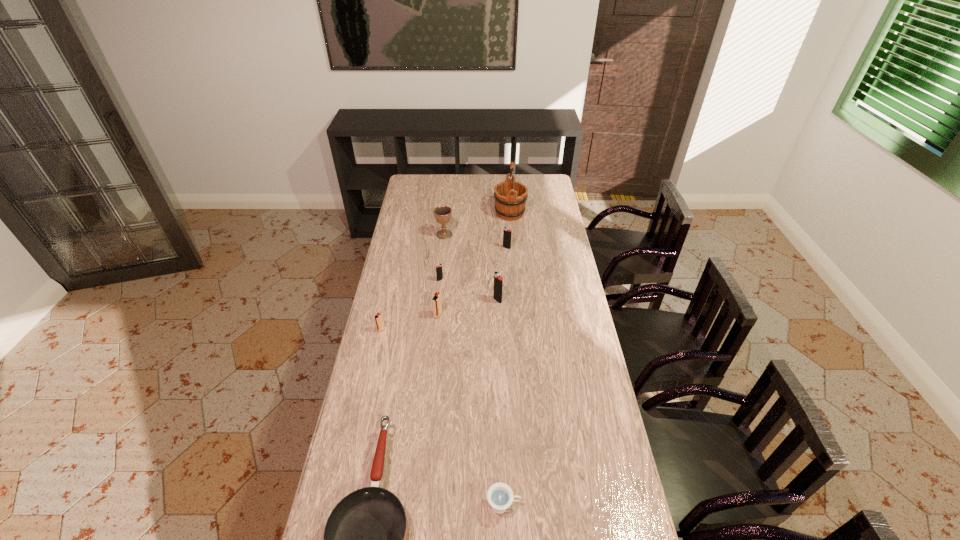
The width and height of the screenshot is (960, 540). In order to click on black igniter object that ranks as the second closest to the second farthest igniter in this screenshot , I will do [x=507, y=232].

The height and width of the screenshot is (540, 960). I want to click on vacant space that satisfies the following two spatial constraints: 1. on the front side of the nearest black igniter; 2. on the right side of the fourth farthest object, so click(x=438, y=300).

Locate an element on the screen. vacant space that satisfies the following two spatial constraints: 1. on the front side of the tallest object; 2. on the side of the blue teacup with the handle is located at coordinates (536, 505).